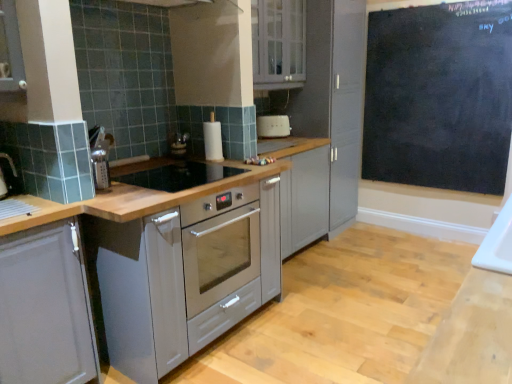
Question: Is matte gray cabinet at left, the first cabinetry positioned from the left, completely or partially outside of white glossy cabinet at upper center, which is the 1th cabinetry in top-to-bottom order?

Choices:
 (A) no
 (B) yes

Answer: (B)

Question: Is matte gray cabinet at left, arranged as the first cabinetry when ordered from the bottom, closer to the viewer compared to white glossy cabinet at upper center, the 2th cabinetry from the bottom?

Choices:
 (A) yes
 (B) no

Answer: (A)

Question: Is matte gray cabinet at left, which ranks as the 2th cabinetry in right-to-left order, aimed at white glossy cabinet at upper center, which is the second cabinetry from left to right?

Choices:
 (A) no
 (B) yes

Answer: (A)

Question: Is matte gray cabinet at left, arranged as the first cabinetry when ordered from the bottom, positioned far away from white glossy cabinet at upper center, which appears as the 1th cabinetry when viewed from the right?

Choices:
 (A) no
 (B) yes

Answer: (B)

Question: From a real-world perspective, is matte gray cabinet at left, which ranks as the second cabinetry in back-to-front order, physically above white glossy cabinet at upper center, which is the second cabinetry from left to right?

Choices:
 (A) no
 (B) yes

Answer: (A)

Question: Is black glass gas stove at center in front of or behind matte gray cabinet at left, the first cabinetry positioned from the left, in the image?

Choices:
 (A) front
 (B) behind

Answer: (B)

Question: Is point (129, 178) closer or farther from the camera than point (8, 276)?

Choices:
 (A) farther
 (B) closer

Answer: (A)

Question: In terms of size, does black glass gas stove at center appear bigger or smaller than matte gray cabinet at left, which ranks as the 2th cabinetry in right-to-left order?

Choices:
 (A) big
 (B) small

Answer: (B)

Question: Considering the relative positions of black glass gas stove at center and matte gray cabinet at left, arranged as the first cabinetry when ordered from the bottom, in the image provided, is black glass gas stove at center to the left or to the right of matte gray cabinet at left, arranged as the first cabinetry when ordered from the bottom,?

Choices:
 (A) right
 (B) left

Answer: (A)

Question: Based on their positions, is matte gray cabinet at left, arranged as the first cabinetry when ordered from the bottom, located to the left or right of black glass gas stove at center?

Choices:
 (A) left
 (B) right

Answer: (A)

Question: Considering the positions of matte gray cabinet at left, arranged as the first cabinetry when ordered from the bottom, and black glass gas stove at center in the image, is matte gray cabinet at left, arranged as the first cabinetry when ordered from the bottom, wider or thinner than black glass gas stove at center?

Choices:
 (A) thin
 (B) wide

Answer: (A)

Question: Based on their sizes in the image, would you say matte gray cabinet at left, which ranks as the second cabinetry in back-to-front order, is bigger or smaller than black glass gas stove at center?

Choices:
 (A) small
 (B) big

Answer: (B)

Question: From the image's perspective, is matte gray cabinet at left, which ranks as the second cabinetry in back-to-front order, positioned above or below black glass gas stove at center?

Choices:
 (A) below
 (B) above

Answer: (A)

Question: In terms of size, does white plastic toaster at center appear bigger or smaller than matte gray cabinet at left, which ranks as the 2th cabinetry in right-to-left order?

Choices:
 (A) big
 (B) small

Answer: (B)

Question: Based on their positions, is white plastic toaster at center located to the left or right of matte gray cabinet at left, the first cabinetry positioned from the left?

Choices:
 (A) left
 (B) right

Answer: (B)